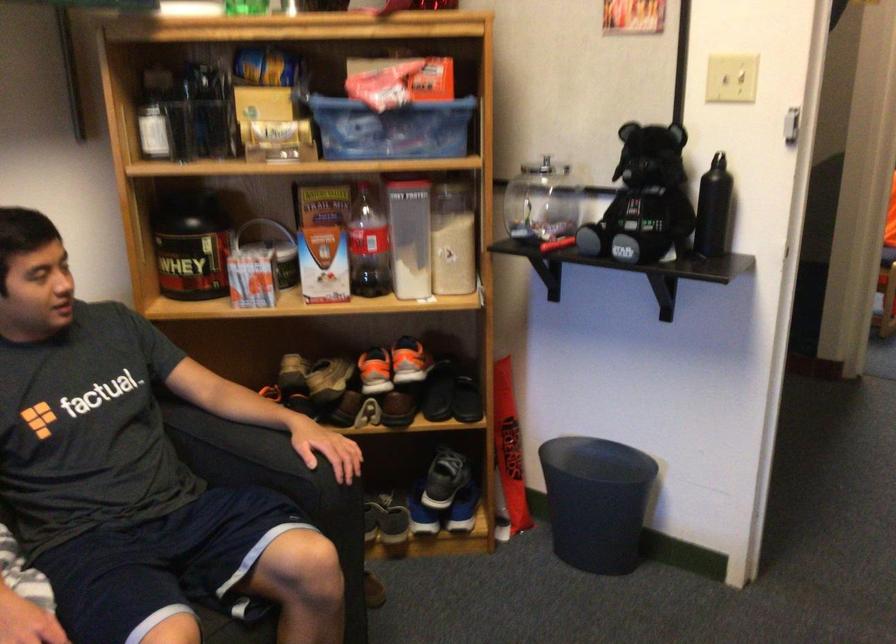
Describe the element at coordinates (597, 460) in the screenshot. This screenshot has height=644, width=896. I see `the black container lid` at that location.